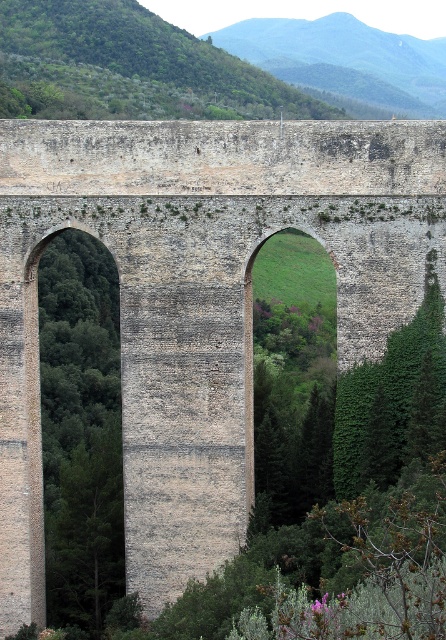
You are standing on the aqueduct and looking towards the distant mountains. Which object is positioned lower in the scene, the green leafy tree at upper left or the green leafy hillside at upper center?

The green leafy tree at upper left is positioned lower than the green leafy hillside at upper center in the scene.

You are an environmental scientist assessing the vegetation distribution in the image. You observe the green leafy tree at upper left and the green leafy hillside at upper center. Which of these two features is located to the left of the other?

The green leafy tree at upper left is positioned on the left side of the green leafy hillside at upper center.

Based on the scene described, which object occupies more horizontal space in the image? The green leafy tree at upper left or the green leafy hillside at upper center?

The green leafy tree at upper left occupies more horizontal space than the green leafy hillside at upper center because its width is larger according to the description.